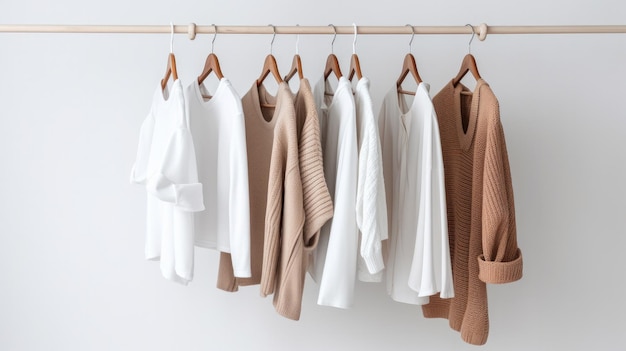
Image resolution: width=626 pixels, height=351 pixels. I want to click on wooden clothes hanger, so click(172, 67), click(217, 67), click(269, 67), click(295, 68), click(331, 68), click(357, 63), click(406, 66), click(473, 63).